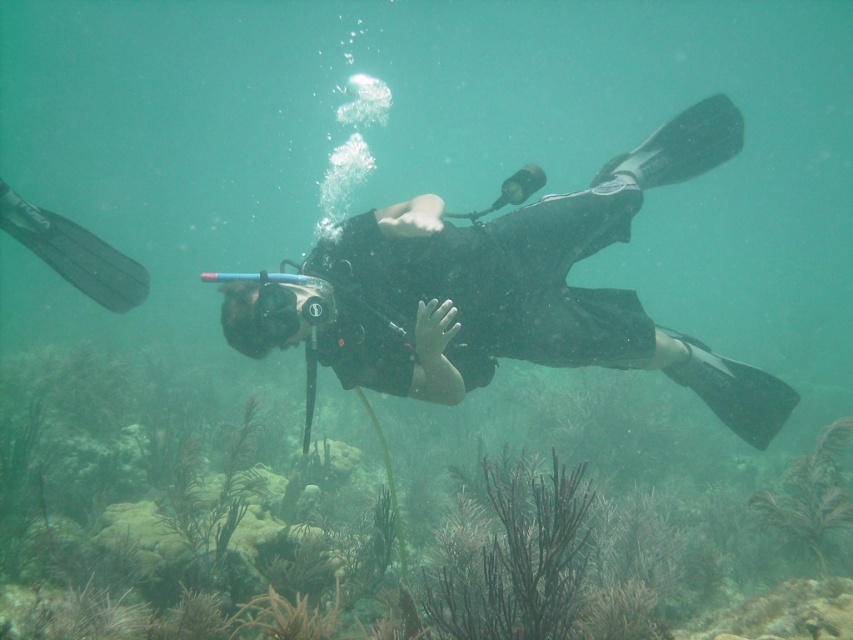
You are a marine biologist observing the underwater scene. You notice the black matte scuba diver at center and the matte black goggles at center. Which object is located more to the right side?

The black matte scuba diver at center is positioned on the right side of matte black goggles at center, so the black matte scuba diver at center is more to the right side.

You are an underwater photographer planning to take a photo of two points in the scene. The first point is at coordinates point [442,460] and the second point is at point [315,282]. Based on the scene description, which point is closer to the camera?

Point [315,282] is closer to the camera because point [442,460] is behind it.

You are a marine biologist observing an underwater scene. You notice the brown coral at center and the black matte scuba diver at center. Which object is taller in this underwater environment?

The brown coral at center is shorter than the black matte scuba diver at center, so the black matte scuba diver at center is taller.